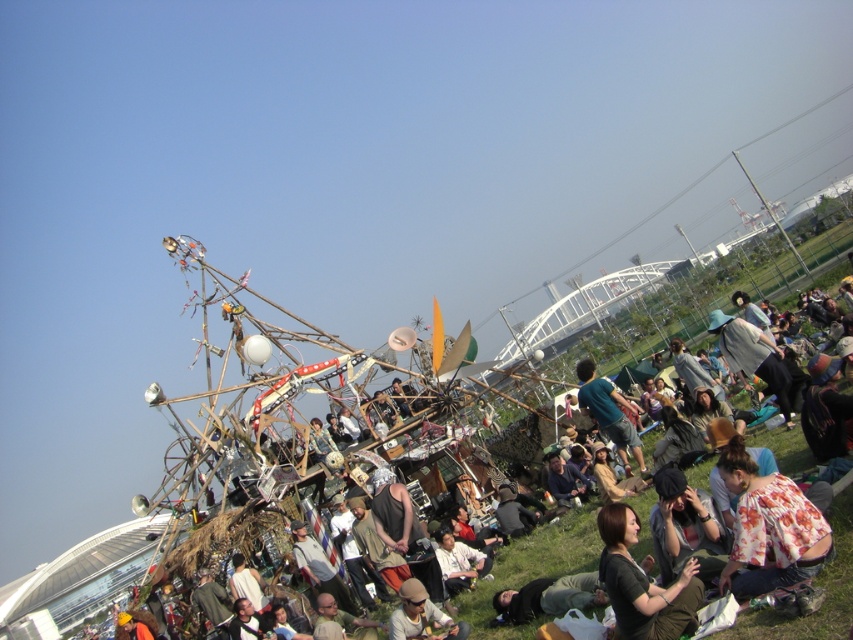
You are standing at the center of the field and see the point marked at coordinates (769, 529). What object is located at that point?

The floral print blouse at lower right is located at point (769, 529).

You are a photographer at the event and want to capture both the black fabric shirt at lower right and the green fabric shirt at center in a single frame. Which shirt should you focus on first to ensure both are in the frame?

The black fabric shirt at lower right has a smaller size compared to green fabric shirt at center. To ensure both are in the frame, focus on the larger green fabric shirt at center first, then adjust the camera to include the smaller black fabric shirt at lower right.